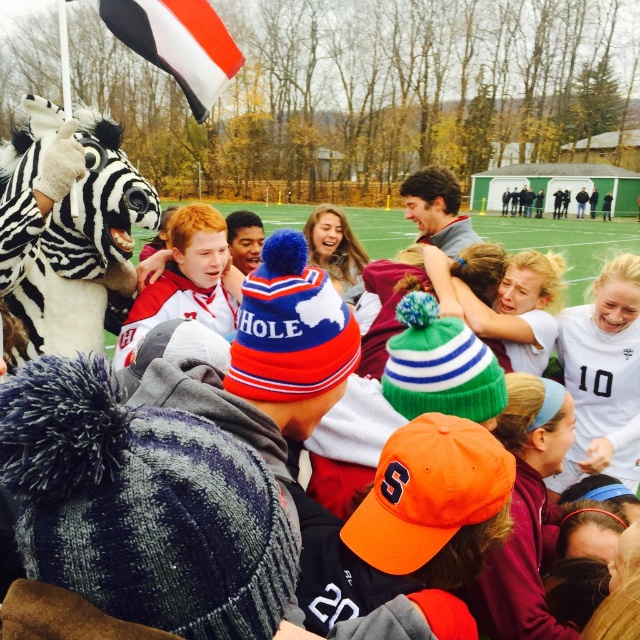
Does white and black striped plush zebra at left have a larger size compared to white/black striped flag at upper left?

Yes, white and black striped plush zebra at left is bigger than white/black striped flag at upper left.

Is point (92, 116) farther from camera compared to point (204, 113)?

No, it is not.

This screenshot has width=640, height=640. Identify the location of white and black striped plush zebra at left. (67, 227).

Where is `white and black striped plush zebra at left`? This screenshot has height=640, width=640. white and black striped plush zebra at left is located at coordinates (67, 227).